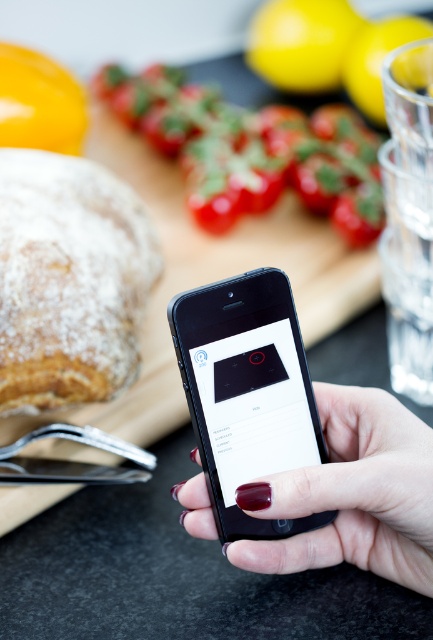
You are a delivery robot approaching the kitchen. You need to place a package on the countertop. There are two points marked as point 1 at coordinates point (417, 445) and point 2 at coordinates point (352, 54). Which point is closer to you as you enter the kitchen?

Point 1 at coordinates point (417, 445) is in front of point 2 at coordinates point (352, 54), so point 1 is closer to you as you enter the kitchen.

You are preparing to arrange the powdery golden bread at left and the yellow matte lemon at upper center on the cutting board. According to their positions, which item is positioned more to the east?

The powdery golden bread at left is positioned to the left of the yellow matte lemon at upper center, so it is more to the east if the cutting board is oriented with left as east.

You are a delivery person who just arrived at the house. You need to place a package on the kitchen counter, but you must ensure it doesn not block the powdery golden bread at left. Given that the package is 30 centimeters wide, can you fit it on the counter without overlapping the bread?

The powdery golden bread at left is 42.31 centimeters away from the viewer. Since the package is only 30 centimeters wide, it can be placed either to the right of the bread or further back on the counter, ensuring it doesn not overlap as long as the total space allows.